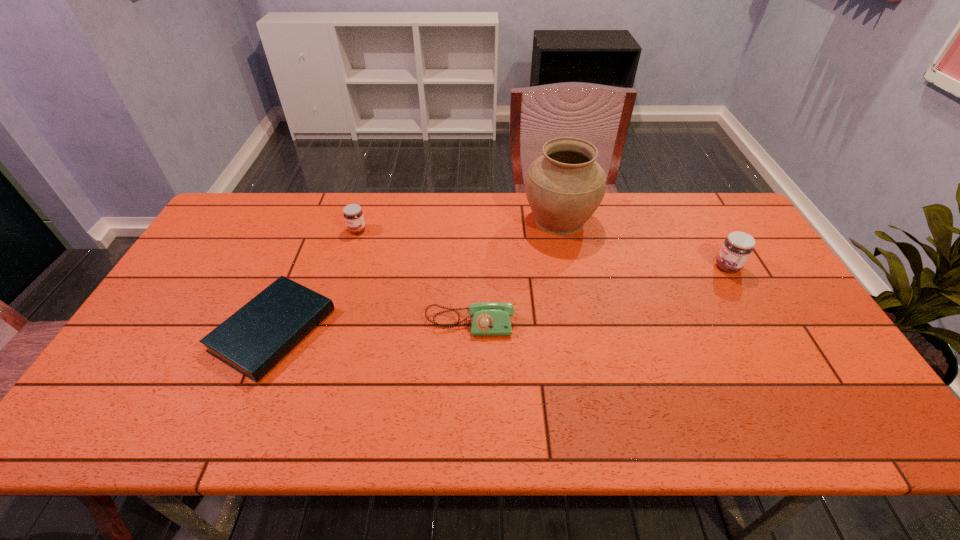
At what (x,y) coordinates should I click in order to perform the action: click on urn. Please return your answer as a coordinate pair (x, y). Looking at the image, I should click on tap(564, 187).

Where is `the tallest object`? The image size is (960, 540). the tallest object is located at coordinates (564, 187).

Locate an element on the screen. This screenshot has width=960, height=540. the rightmost object is located at coordinates (736, 249).

Find the location of a particular element. The height and width of the screenshot is (540, 960). the second tallest object is located at coordinates (736, 249).

At what (x,y) coordinates should I click in order to perform the action: click on the shorter jam. Please return your answer as a coordinate pair (x, y). Image resolution: width=960 pixels, height=540 pixels. Looking at the image, I should click on (353, 215).

Locate an element on the screen. the left jam is located at coordinates (353, 215).

Identify the location of the second shortest object. (487, 318).

Where is `the third object from left to right`? This screenshot has height=540, width=960. the third object from left to right is located at coordinates (487, 318).

This screenshot has height=540, width=960. Identify the location of book. (260, 334).

I want to click on vacant space located 0.280m on the front of the tallest object, so click(578, 312).